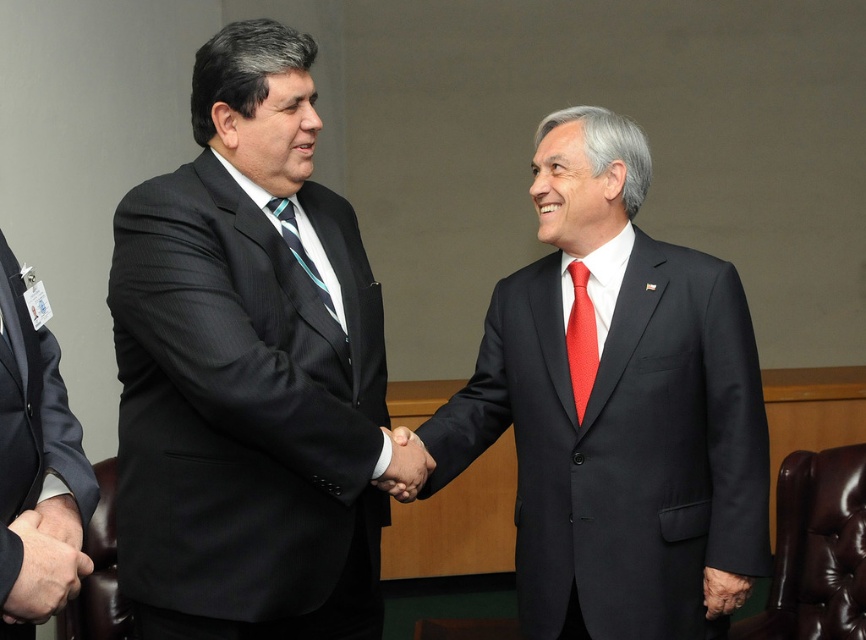
Does matte black suit at center lie behind dark blue suit at left?

Yes.

Which is above, matte black suit at center or dark blue suit at left?

matte black suit at center is above.

The height and width of the screenshot is (640, 866). Find the location of `matte black suit at center`. matte black suit at center is located at coordinates (247, 371).

The image size is (866, 640). I want to click on matte black suit at center, so point(247,371).

Between matte black suit at right and dark blue suit at left, which one has more height?

With more height is matte black suit at right.

Is matte black suit at right closer to the viewer compared to dark blue suit at left?

That is False.

Does point (453, 406) lie in front of point (47, 460)?

No.

Image resolution: width=866 pixels, height=640 pixels. What are the coordinates of `matte black suit at right` in the screenshot? It's located at (621, 444).

This screenshot has height=640, width=866. Describe the element at coordinates (247, 371) in the screenshot. I see `matte black suit at center` at that location.

In order to click on matte black suit at center in this screenshot , I will do `click(247, 371)`.